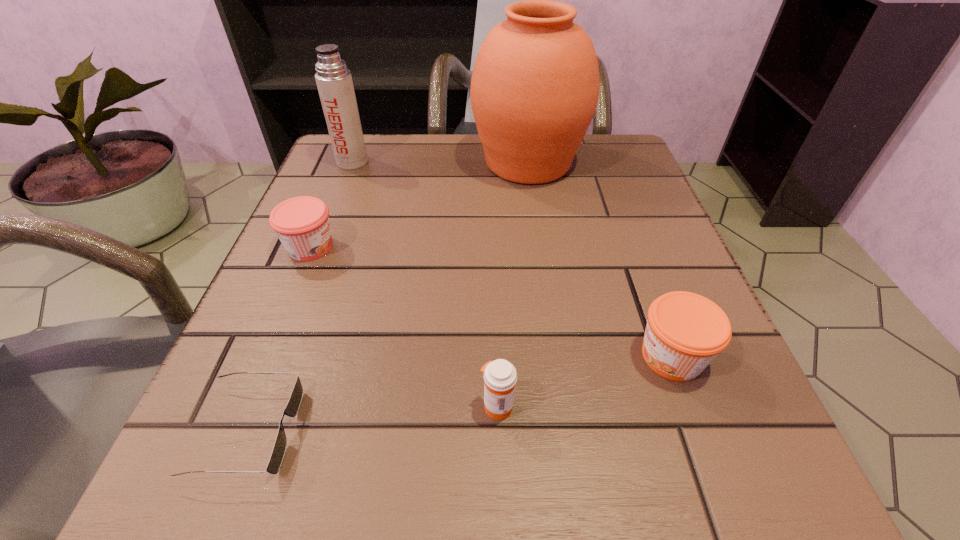
The width and height of the screenshot is (960, 540). Identify the location of urn. (535, 85).

This screenshot has width=960, height=540. What are the coordinates of `the fifth shortest object` in the screenshot? It's located at (334, 81).

Where is `medicine`? This screenshot has height=540, width=960. medicine is located at coordinates (500, 376).

Identify the location of the nearer jam. The width and height of the screenshot is (960, 540). (685, 331).

Identify the location of the third farthest object. (302, 224).

The height and width of the screenshot is (540, 960). In order to click on the farther jam in this screenshot , I will do `click(302, 224)`.

Identify the location of sunglasses. (292, 408).

The image size is (960, 540). Find the location of `vacant space situated on the front of the urn`. vacant space situated on the front of the urn is located at coordinates (553, 334).

The width and height of the screenshot is (960, 540). Identify the location of free space located on the front of the thermos bottle. (329, 220).

Where is `vacant space located 0.300m on the right of the medicine`? The width and height of the screenshot is (960, 540). vacant space located 0.300m on the right of the medicine is located at coordinates (756, 406).